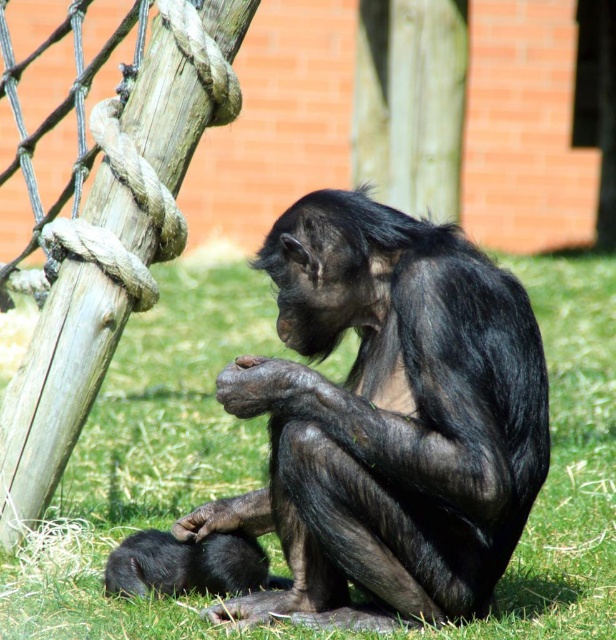
Question: Among these objects, which one is farthest from the camera?

Choices:
 (A) shiny black monkey at center
 (B) shiny black monkey at lower left

Answer: (B)

Question: Is shiny black monkey at center in front of shiny black monkey at lower left?

Choices:
 (A) yes
 (B) no

Answer: (A)

Question: Is shiny black monkey at center positioned behind shiny black monkey at lower left?

Choices:
 (A) no
 (B) yes

Answer: (A)

Question: Which of the following is the farthest from the observer?

Choices:
 (A) (334, 346)
 (B) (134, 561)

Answer: (B)

Question: Does shiny black monkey at center appear on the left side of shiny black monkey at lower left?

Choices:
 (A) no
 (B) yes

Answer: (A)

Question: Among these points, which one is farthest from the camera?

Choices:
 (A) (426, 376)
 (B) (110, 580)

Answer: (B)